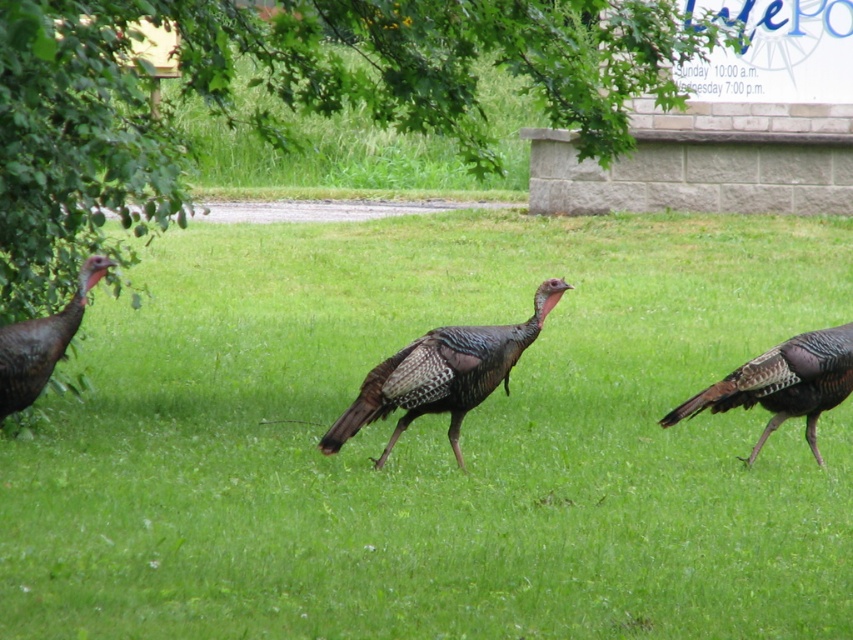
Question: Is brown speckled turkey at center wider than brown feathered turkey at left?

Choices:
 (A) yes
 (B) no

Answer: (A)

Question: Which of the following is the farthest from the observer?

Choices:
 (A) (468, 340)
 (B) (757, 282)
 (C) (833, 365)

Answer: (B)

Question: Is brown feathered turkey at center to the left of brown feathered turkey at left from the viewer's perspective?

Choices:
 (A) no
 (B) yes

Answer: (A)

Question: Is brown speckled turkey at center wider than shiny brown turkey at center?

Choices:
 (A) yes
 (B) no

Answer: (A)

Question: Which point is closer to the camera?

Choices:
 (A) (811, 433)
 (B) (254, 564)

Answer: (B)

Question: Which of the following is the farthest from the observer?

Choices:
 (A) brown feathered turkey at center
 (B) brown feathered turkey at left
 (C) brown speckled turkey at center

Answer: (C)